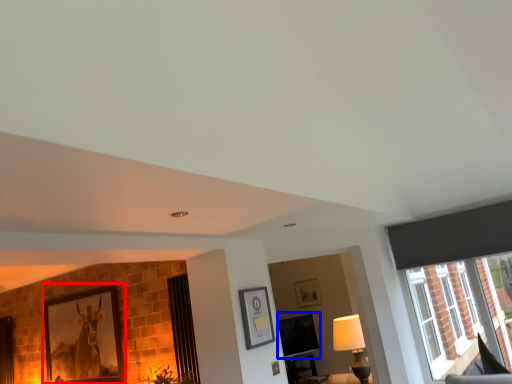
Question: Which of the following is the farthest to the observer, picture frame (highlighted by a red box) or window screen (highlighted by a blue box)?

Choices:
 (A) picture frame
 (B) window screen

Answer: (B)